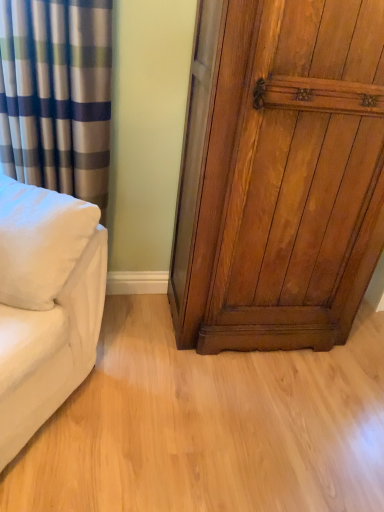
Question: In the image, is shiny brown wood door at right positioned in front of or behind white soft pillow at left?

Choices:
 (A) front
 (B) behind

Answer: (B)

Question: In terms of width, does shiny brown wood door at right look wider or thinner when compared to white soft pillow at left?

Choices:
 (A) wide
 (B) thin

Answer: (A)

Question: Which of these objects is positioned farthest from the white soft pillow at left?

Choices:
 (A) silky blue-green striped curtain at left
 (B) light wood floor at center
 (C) shiny brown wood door at right

Answer: (B)

Question: Based on their relative distances, which object is farther from the white soft pillow at left?

Choices:
 (A) shiny brown wood door at right
 (B) silky blue-green striped curtain at left
 (C) light wood floor at center

Answer: (C)